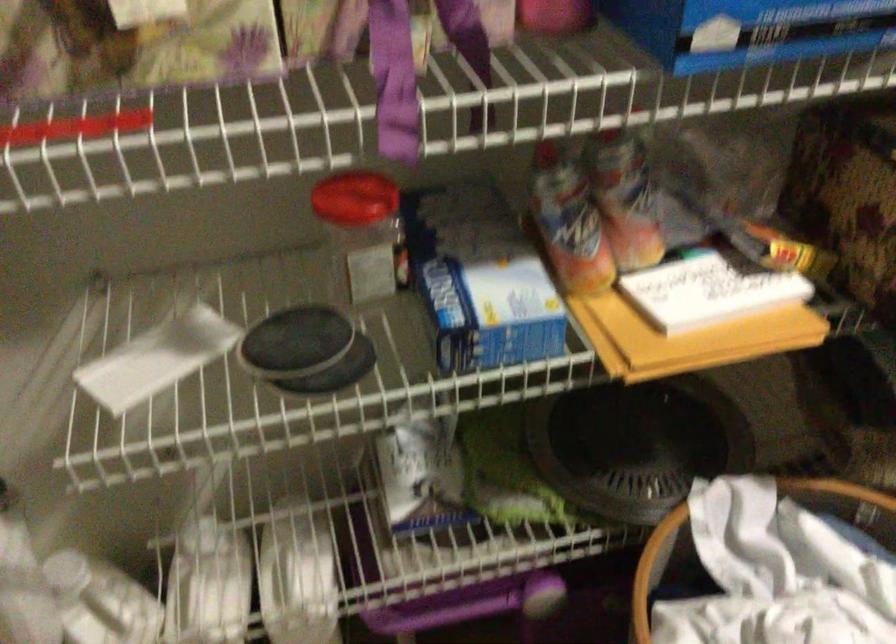
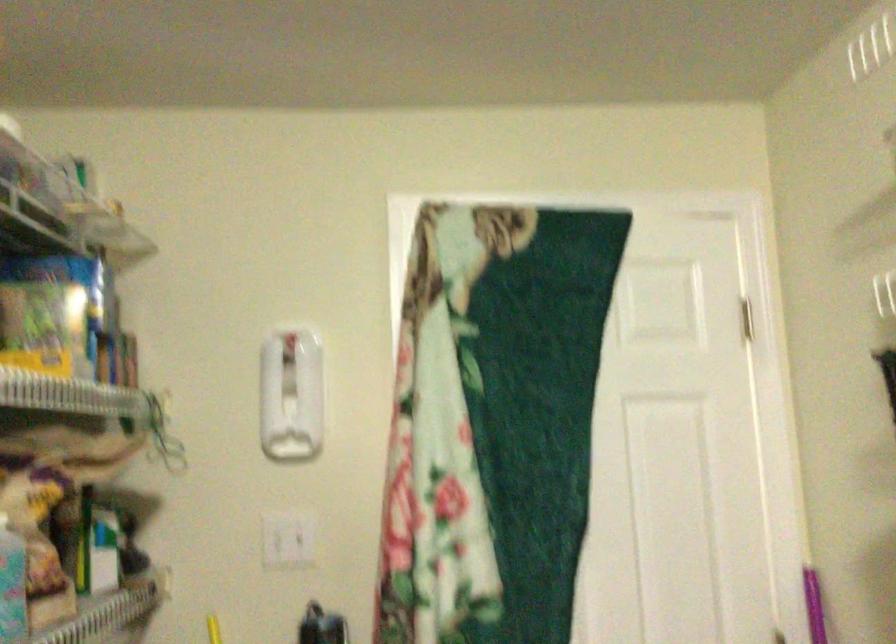
Question: Based on the continuous images, in which direction is the camera rotating? Reply with the corresponding letter.

Choices:
 (A) Left
 (B) Right
 (C) Up
 (D) Down

Answer: (A)